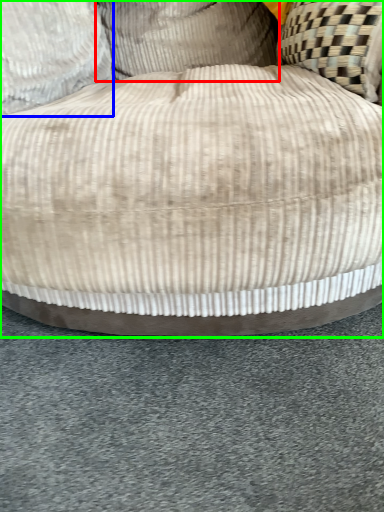
Question: Considering the real-world distances, which object is closest to pillow (highlighted by a red box)? pillow (highlighted by a blue box) or furniture (highlighted by a green box).

Choices:
 (A) pillow
 (B) furniture

Answer: (A)